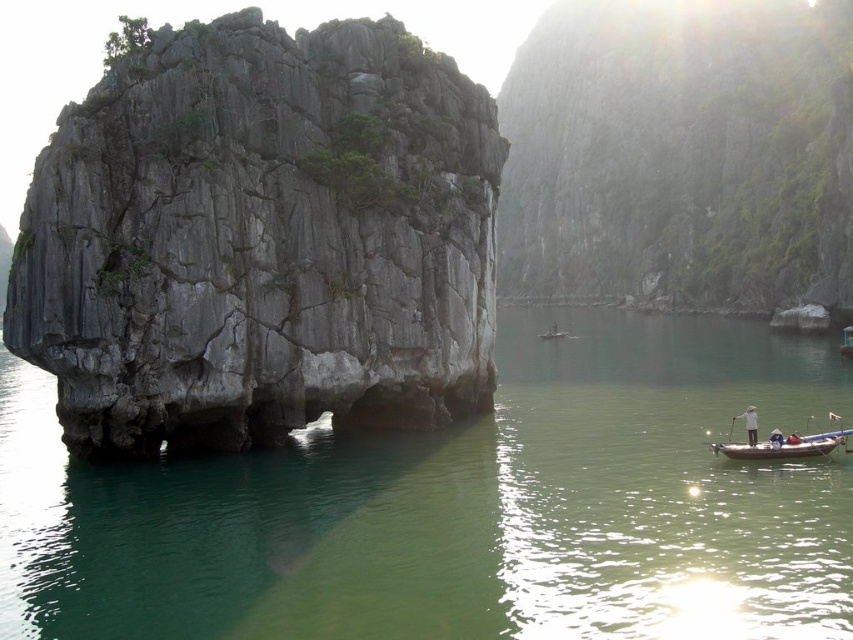
Does green water at center have a greater width compared to gray rock cliff at center?

Yes.

Which is more to the left, green water at center or gray rock cliff at center?

From the viewer's perspective, green water at center appears more on the left side.

Locate an element on the screen. The height and width of the screenshot is (640, 853). green water at center is located at coordinates (461, 508).

Between green water at center and wooden canoe at lower right, which one is positioned lower?

Positioned lower is wooden canoe at lower right.

Where is `green water at center`? The height and width of the screenshot is (640, 853). green water at center is located at coordinates (461, 508).

Can you confirm if gray rock cliff at center is smaller than wooden canoe at lower right?

Actually, gray rock cliff at center might be larger than wooden canoe at lower right.

Who is taller, gray rock cliff at center or wooden canoe at lower right?

gray rock cliff at center is taller.

What are the coordinates of `gray rock cliff at center` in the screenshot? It's located at (682, 156).